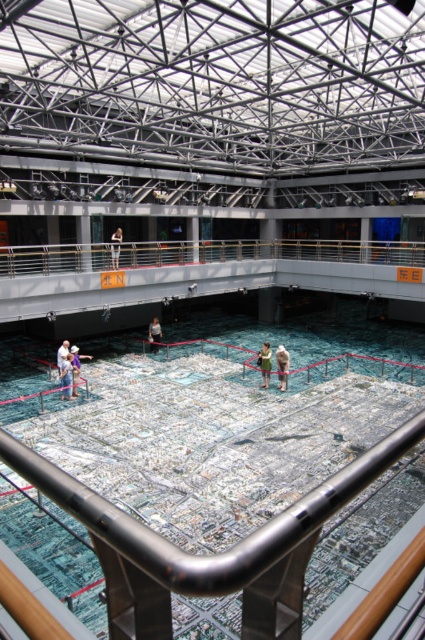
Is denim pants at lower left positioned behind light brown leather jacket at center?

No.

Can you confirm if denim pants at lower left is positioned to the right of light brown leather jacket at center?

Incorrect, denim pants at lower left is not on the right side of light brown leather jacket at center.

You are a GUI agent. You are given a task and a screenshot of the screen. Output one action in this format:
    pyautogui.click(x=<x>, y=<y>)
    Task: Click on the denim pants at lower left
    This screenshot has width=425, height=640.
    Given the screenshot: What is the action you would take?
    pyautogui.click(x=67, y=376)

Where is `denim pants at lower left`? denim pants at lower left is located at coordinates tap(67, 376).

Who is shorter, white paper map at center or light brown fabric shirt at center?

Standing shorter between the two is light brown fabric shirt at center.

Which is more to the left, white paper map at center or light brown fabric shirt at center?

Positioned to the left is light brown fabric shirt at center.

Is point (133, 524) in front of point (153, 339)?

Yes, point (133, 524) is closer to viewer.

At what (x,y) coordinates should I click in order to perform the action: click on white paper map at center. Please return your answer as a coordinate pair (x, y). Looking at the image, I should click on (195, 554).

Can you confirm if white cotton dress at center is shorter than light brown fabric shirt at center?

In fact, white cotton dress at center may be taller than light brown fabric shirt at center.

Does white cotton dress at center appear over light brown fabric shirt at center?

Actually, white cotton dress at center is below light brown fabric shirt at center.

Is point (280, 349) in front of point (150, 337)?

Yes, point (280, 349) is in front of point (150, 337).

Where is `white cotton dress at center`? The height and width of the screenshot is (640, 425). white cotton dress at center is located at coordinates (282, 365).